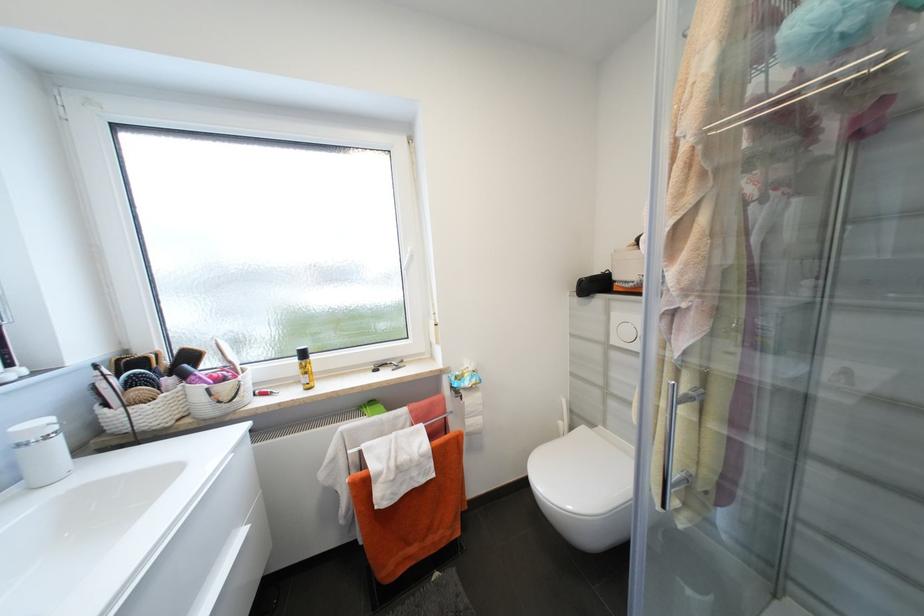
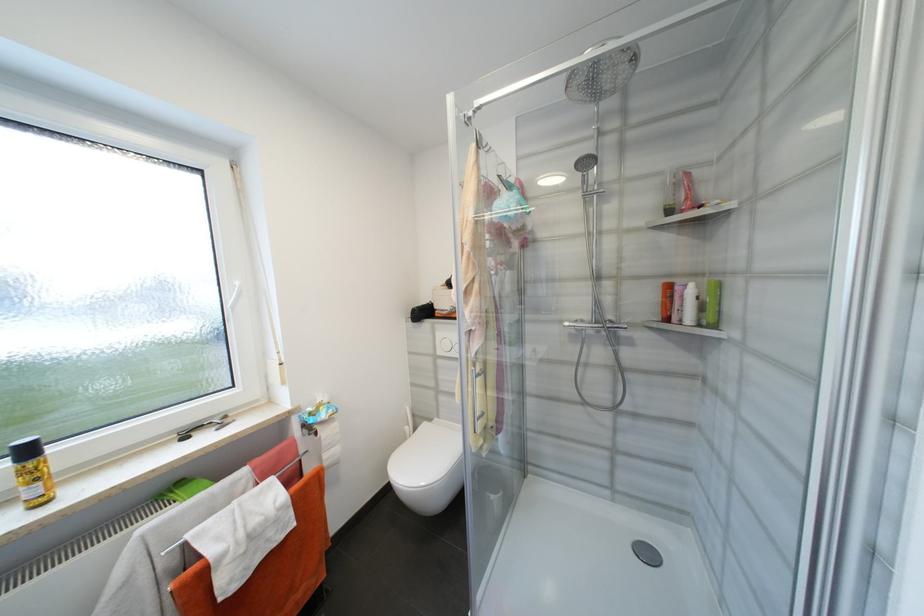
The point at (x=606, y=339) is marked in the first image. Where is the corresponding point in the second image?

(436, 352)